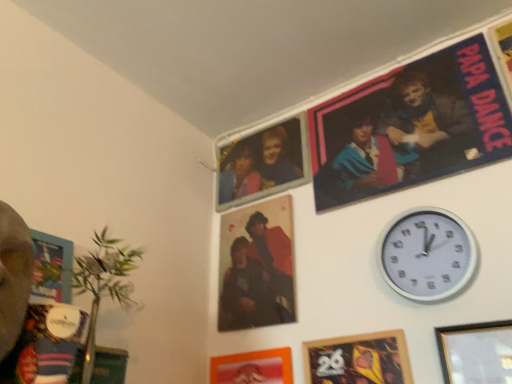
Question: From their relative heights in the image, would you say wooden picture frame at lower right, the third picture frame positioned from the left, is taller or shorter than matte plastic photo frame at upper center?

Choices:
 (A) short
 (B) tall

Answer: (B)

Question: Based on their sizes in the image, would you say wooden picture frame at lower right, placed as the 1th picture frame when sorted from right to left, is bigger or smaller than matte plastic photo frame at upper center?

Choices:
 (A) big
 (B) small

Answer: (B)

Question: Estimate the real-world distances between objects in this image. Which object is farther from the matte orange picture frame at lower center, arranged as the 3th picture frame when viewed from the right?

Choices:
 (A) white plastic wall clock at upper right
 (B) wooden framed poster at lower center, acting as the second picture frame starting from the right
 (C) wooden picture frame at lower right, placed as the 1th picture frame when sorted from right to left
 (D) matte plastic photo frame at upper center
 (E) matte blue fabric poster at upper right

Answer: (E)

Question: Estimate the real-world distances between objects in this image. Which object is closer to the matte plastic photo frame at upper center?

Choices:
 (A) matte orange picture frame at lower center, the 1th picture frame positioned from the left
 (B) matte blue fabric poster at upper right
 (C) white plastic wall clock at upper right
 (D) wooden picture frame at lower right, the third picture frame positioned from the left
 (E) wooden framed poster at lower center, acting as the second picture frame starting from the right

Answer: (B)